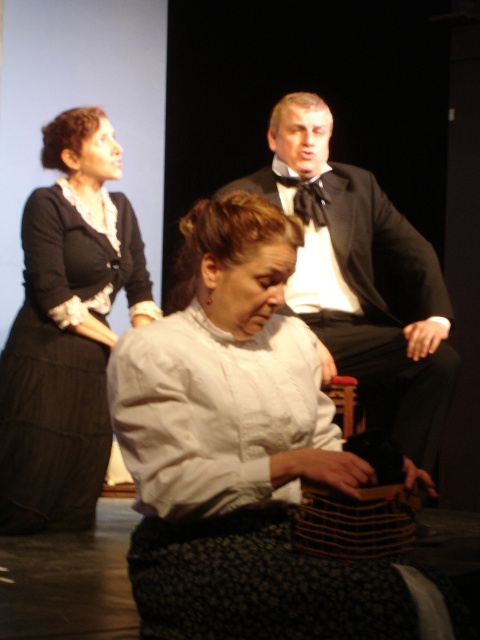
Can you confirm if white cotton blouse at center is positioned above black satin bow tie at upper center?

No, white cotton blouse at center is not above black satin bow tie at upper center.

The image size is (480, 640). In order to click on white cotton blouse at center in this screenshot , I will do `click(242, 452)`.

Is the position of matte black dress at left less distant than that of black satin tuxedo at upper center?

No, it is not.

Consider the image. Measure the distance between matte black dress at left and camera.

2.95 meters

Locate an element on the screen. This screenshot has width=480, height=640. matte black dress at left is located at coordinates (67, 330).

Can you confirm if white cotton blouse at center is bigger than black satin tuxedo at upper center?

No.

Which of these two, white cotton blouse at center or black satin tuxedo at upper center, stands shorter?

white cotton blouse at center is shorter.

The width and height of the screenshot is (480, 640). Identify the location of white cotton blouse at center. (242, 452).

You are a GUI agent. You are given a task and a screenshot of the screen. Output one action in this format:
    pyautogui.click(x=<x>, y=<y>)
    Task: Click on the white cotton blouse at center
    The image size is (480, 640).
    Given the screenshot: What is the action you would take?
    pyautogui.click(x=242, y=452)